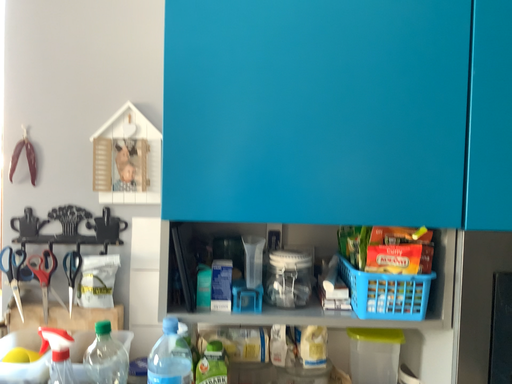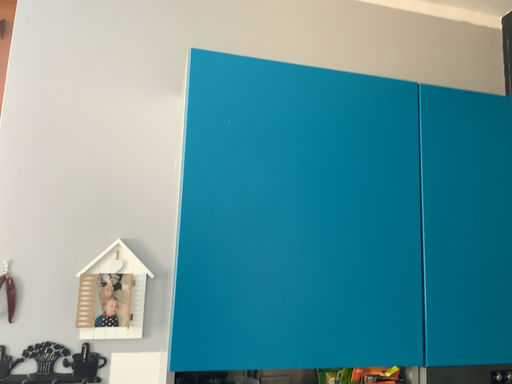
Question: Which way did the camera rotate in the video?

Choices:
 (A) rotated downward
 (B) rotated upward

Answer: (B)